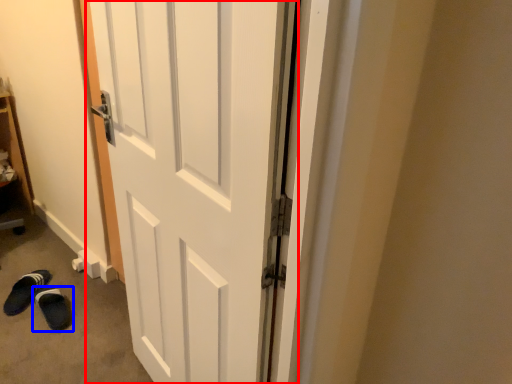
Question: Which object is closer to the camera taking this photo, door (highlighted by a red box) or footwear (highlighted by a blue box)?

Choices:
 (A) door
 (B) footwear

Answer: (A)